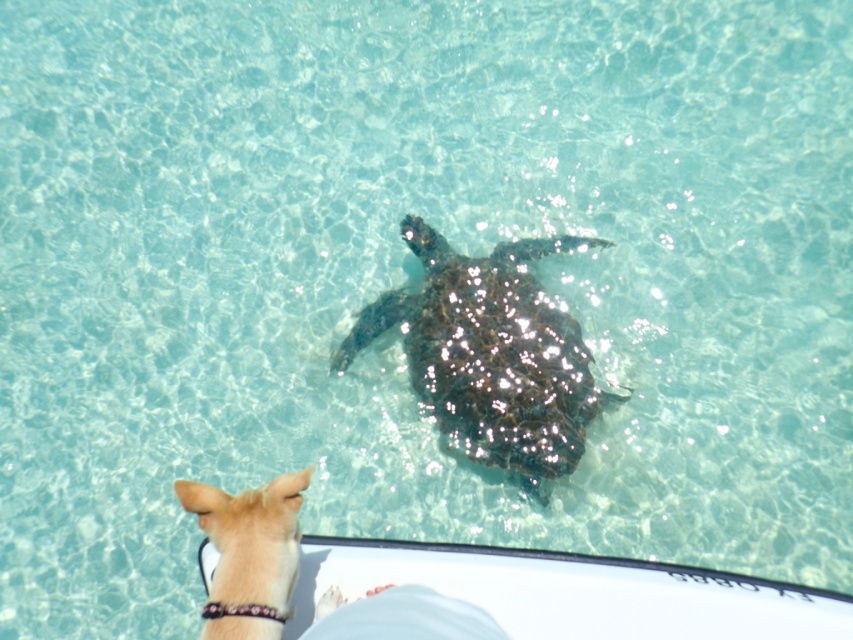
You are a marine biologist observing the scene. You notice the shiny dark brown turtle at center and the light brown fur at lower left. Which object is located closer to the viewer?

The shiny dark brown turtle at center is positioned over light brown fur at lower left, meaning it is closer to the viewer.

You are a marine biologist observing the scene. You notice the shiny dark brown turtle at center and the light brown fur at lower left. Which object is closer to the observer?

The shiny dark brown turtle at center is closer to the observer than the light brown fur at lower left because the light brown fur at lower left is behind the turtle.

You are a marine biologist observing the scene. You need to determine the relative sizes of the shiny dark brown turtle at center and the light brown fur at lower left. Based on the image, which object is wider?

The shiny dark brown turtle at center is wider than the light brown fur at lower left.